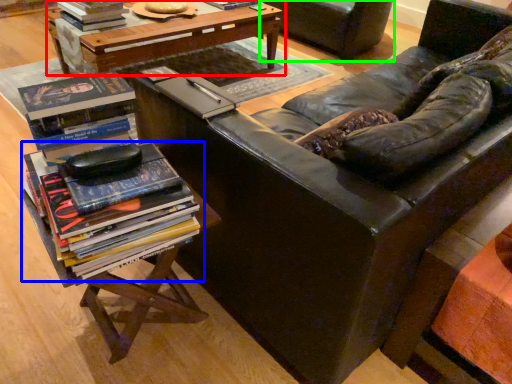
Question: Considering the real-world distances, which object is farthest from table (highlighted by a red box)? book (highlighted by a blue box) or chair (highlighted by a green box)?

Choices:
 (A) book
 (B) chair

Answer: (A)